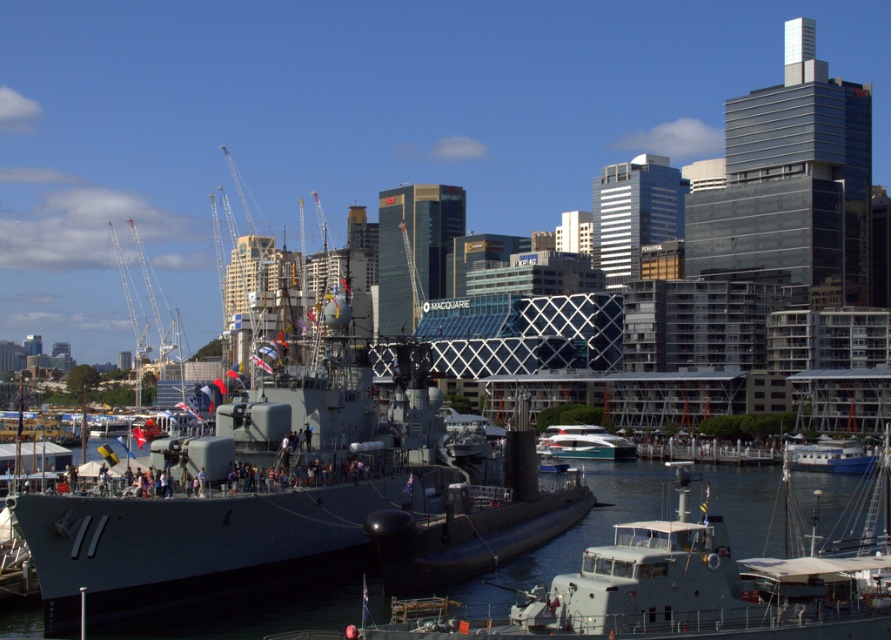
Question: Among these points, which one is nearest to the camera?

Choices:
 (A) (605, 433)
 (B) (846, 451)
 (C) (619, 614)

Answer: (C)

Question: Which object appears closest to the camera in this image?

Choices:
 (A) blue matte boat at lower right
 (B) metallic gray boat at center

Answer: (B)

Question: Which object is positioned closest to the metallic gray boat at center?

Choices:
 (A) blue matte boat at lower right
 (B) white glossy yacht at center

Answer: (A)

Question: Does white glossy yacht at center appear on the right side of blue matte boat at lower right?

Choices:
 (A) yes
 (B) no

Answer: (B)

Question: Can you confirm if white glossy yacht at center is bigger than blue matte boat at lower right?

Choices:
 (A) yes
 (B) no

Answer: (A)

Question: Does white glossy yacht at center come in front of blue matte boat at lower right?

Choices:
 (A) yes
 (B) no

Answer: (B)